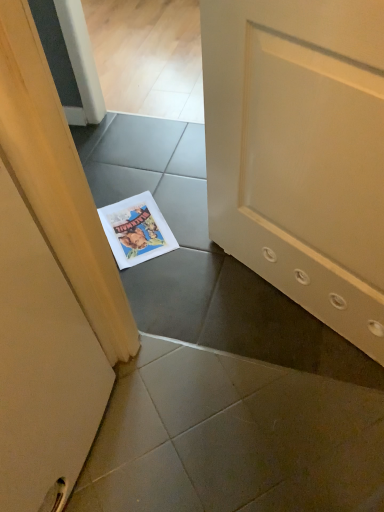
I want to click on vacant area on top of white paper comic book at center (from a real-world perspective), so click(x=139, y=229).